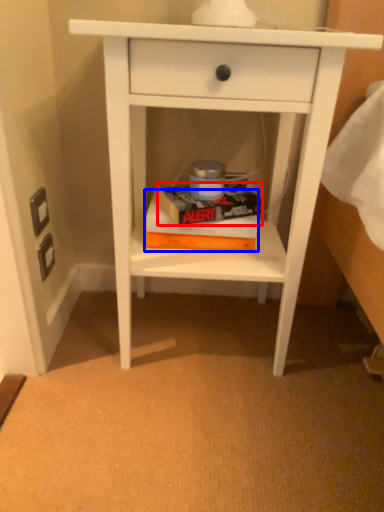
Question: Which object appears farthest to the camera in this image, paperback book (highlighted by a red box) or paperback book (highlighted by a blue box)?

Choices:
 (A) paperback book
 (B) paperback book

Answer: (B)